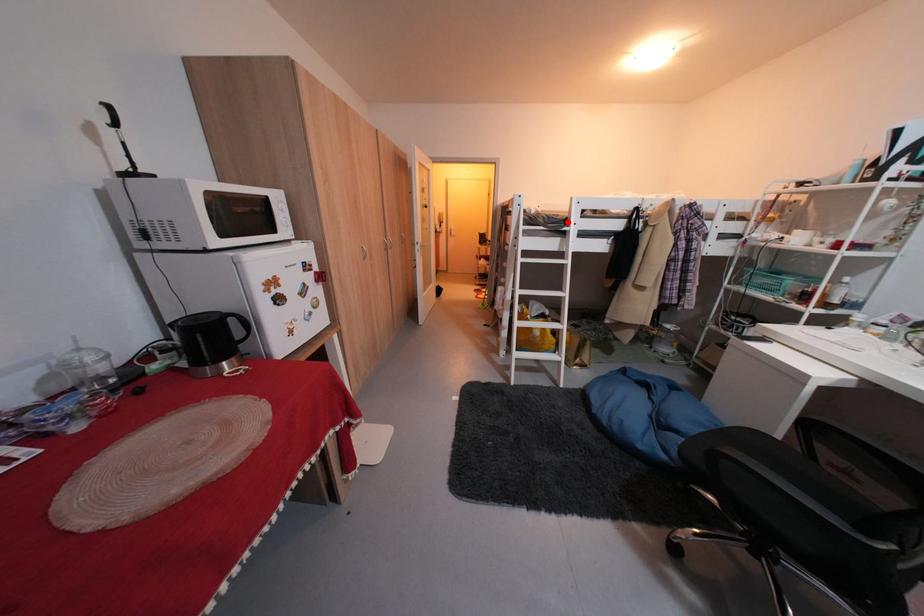
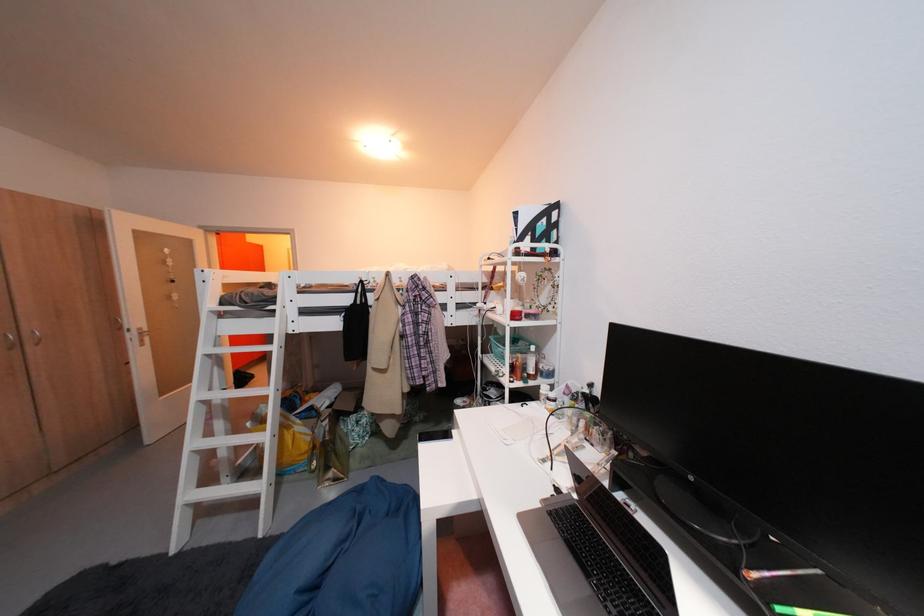
Locate, in the second image, the point that corresponds to the highlighted location in the first image.

(276, 300)